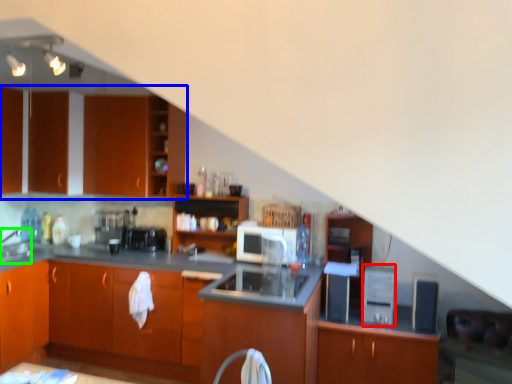
Question: Which object is the farthest from appliance (highlighted by a red box)? Choose among these: cabinetry (highlighted by a blue box) or sink (highlighted by a green box).

Choices:
 (A) cabinetry
 (B) sink

Answer: (B)